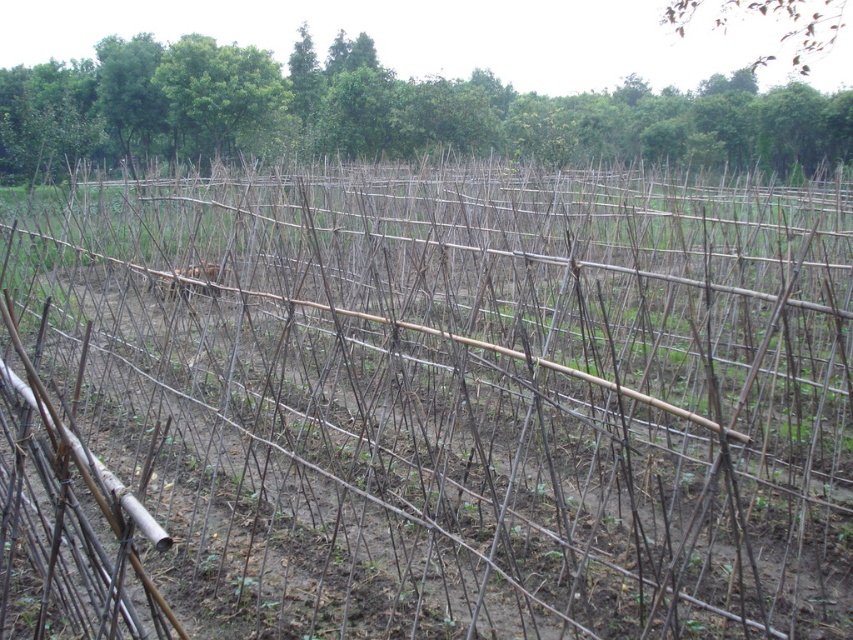
Question: Does green leafy tree at upper center lie behind brown wood tree at upper right?

Choices:
 (A) no
 (B) yes

Answer: (B)

Question: Can you confirm if green leafy tree at upper center is bigger than brown wood tree at upper right?

Choices:
 (A) no
 (B) yes

Answer: (A)

Question: Which of the following is the closest to the observer?

Choices:
 (A) (822, 45)
 (B) (218, 138)

Answer: (B)

Question: Considering the relative positions of green leafy tree at upper center and brown wood tree at upper right in the image provided, where is green leafy tree at upper center located with respect to brown wood tree at upper right?

Choices:
 (A) below
 (B) above

Answer: (A)